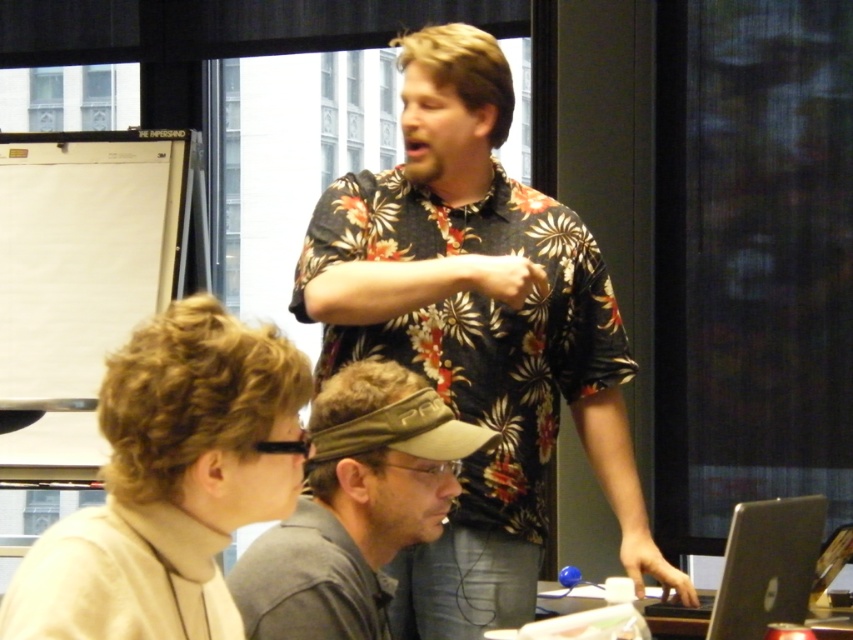
You are organizing a charity event and need to display two items on a shelf. The beige turtleneck sweater at lower left and the gray fabric cap at center must be placed side by side. Given that the shelf is only 20 cm wide, will both items fit if placed next to each other?

The beige turtleneck sweater at lower left is narrower than the gray fabric cap at center. However, without knowing the exact widths of both items, we cannot determine if their combined width exceeds 20 cm. Additional measurements are needed.

You are organizing a small event and need to place a 20 inch wide decorative item between the gray fabric cap at center and the silver metallic laptop at lower right. Can you fit it there?

The distance between the gray fabric cap at center and the silver metallic laptop at lower right is 25.44 inches, so yes, the 20 inch wide decorative item can fit between them since it is narrower than the available space.

Consider the image. You are standing in the meeting room and need to locate the beige turtleneck sweater at lower left. According to the spatial coordinates provided, where exactly is it positioned?

The beige turtleneck sweater at lower left is located at point coordinates of (171, 483).